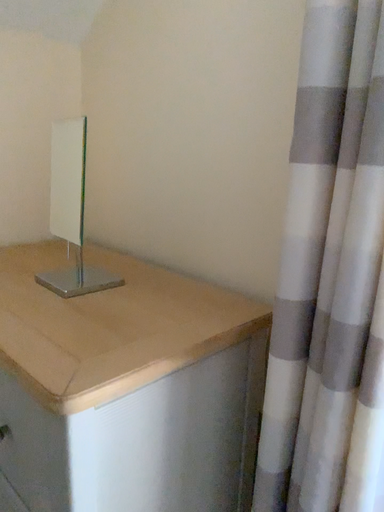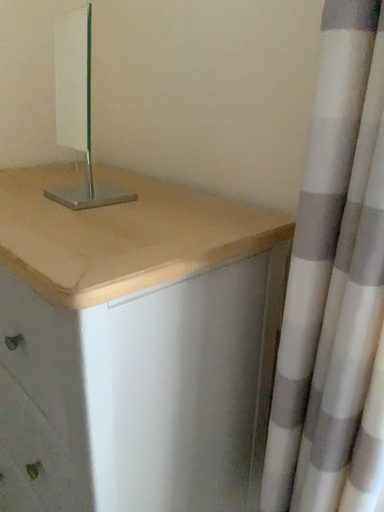
Question: Which way did the camera rotate in the video?

Choices:
 (A) rotated downward
 (B) rotated upward

Answer: (A)